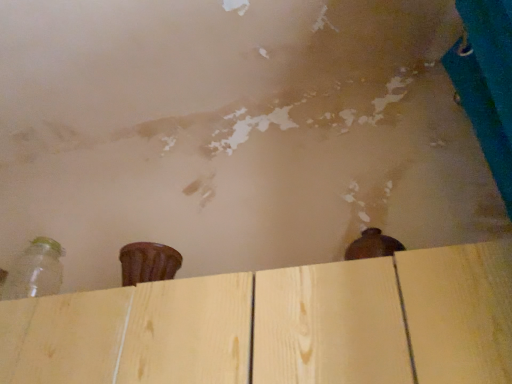
The image size is (512, 384). What do you see at coordinates (35, 271) in the screenshot?
I see `transparent glass bottle at lower left` at bounding box center [35, 271].

Identify the location of transparent glass bottle at lower left. (35, 271).

What do you see at coordinates (280, 325) in the screenshot? The height and width of the screenshot is (384, 512). I see `natural wood plywood at center` at bounding box center [280, 325].

Locate an element on the screen. Image resolution: width=512 pixels, height=384 pixels. natural wood plywood at center is located at coordinates (280, 325).

The height and width of the screenshot is (384, 512). I want to click on transparent glass bottle at lower left, so click(35, 271).

Can you confirm if transparent glass bottle at lower left is positioned to the left of natural wood plywood at center?

Yes, transparent glass bottle at lower left is to the left of natural wood plywood at center.

In the scene shown: Which object is further away from the camera taking this photo, transparent glass bottle at lower left or natural wood plywood at center?

transparent glass bottle at lower left is more distant.

Is point (50, 282) closer or farther from the camera than point (304, 366)?

Point (50, 282) is positioned farther from the camera compared to point (304, 366).

From the image's perspective, relative to natural wood plywood at center, is transparent glass bottle at lower left above or below?

Based on their image positions, transparent glass bottle at lower left is located above natural wood plywood at center.

From a real-world perspective, is transparent glass bottle at lower left under natural wood plywood at center?

Actually, transparent glass bottle at lower left is physically above natural wood plywood at center in the real world.

Based on the photo, in terms of width, does transparent glass bottle at lower left look wider or thinner when compared to natural wood plywood at center?

transparent glass bottle at lower left is thinner than natural wood plywood at center.

Looking at this image, which of these two, transparent glass bottle at lower left or natural wood plywood at center, stands taller?

With more height is natural wood plywood at center.

Considering the sizes of transparent glass bottle at lower left and natural wood plywood at center in the image, is transparent glass bottle at lower left bigger or smaller than natural wood plywood at center?

In the image, transparent glass bottle at lower left appears to be smaller than natural wood plywood at center.

Is transparent glass bottle at lower left situated inside natural wood plywood at center or outside?

transparent glass bottle at lower left exists outside the volume of natural wood plywood at center.

Is transparent glass bottle at lower left beside natural wood plywood at center?

No, transparent glass bottle at lower left is not next to natural wood plywood at center.

Is transparent glass bottle at lower left aimed at natural wood plywood at center?

No.

Can you tell me how much transparent glass bottle at lower left and natural wood plywood at center differ in facing direction?

The angular difference between transparent glass bottle at lower left and natural wood plywood at center is 1.16 degrees.

Where is `bottle above the natural wood plywood at center (from the image's perspective)`? This screenshot has height=384, width=512. bottle above the natural wood plywood at center (from the image's perspective) is located at coordinates (35, 271).

Visually, is natural wood plywood at center positioned to the left or to the right of transparent glass bottle at lower left?

natural wood plywood at center is to the right of transparent glass bottle at lower left.

Between natural wood plywood at center and transparent glass bottle at lower left, which one is positioned behind?

transparent glass bottle at lower left is further from the camera.

Is point (398, 285) less distant than point (32, 244)?

Yes, point (398, 285) is in front of point (32, 244).

From the image's perspective, is natural wood plywood at center under transparent glass bottle at lower left?

Yes.

From a real-world perspective, who is located lower, natural wood plywood at center or transparent glass bottle at lower left?

natural wood plywood at center is physically lower.

Based on the photo, is natural wood plywood at center wider than transparent glass bottle at lower left?

Yes.

Which of these two, natural wood plywood at center or transparent glass bottle at lower left, stands taller?

natural wood plywood at center.

Considering the sizes of objects natural wood plywood at center and transparent glass bottle at lower left in the image provided, who is bigger, natural wood plywood at center or transparent glass bottle at lower left?

Bigger between the two is natural wood plywood at center.

Can transparent glass bottle at lower left be found inside natural wood plywood at center?

No, transparent glass bottle at lower left is not inside natural wood plywood at center.

Would you consider natural wood plywood at center to be distant from transparent glass bottle at lower left?

natural wood plywood at center is near transparent glass bottle at lower left, not far away.

Does natural wood plywood at center turn towards transparent glass bottle at lower left?

No, natural wood plywood at center is not facing towards transparent glass bottle at lower left.

What's the angular difference between natural wood plywood at center and transparent glass bottle at lower left's facing directions?

There is a 1.16-degree angle between the facing directions of natural wood plywood at center and transparent glass bottle at lower left.

Find the location of `bottle above the natural wood plywood at center (from a real-world perspective)`. bottle above the natural wood plywood at center (from a real-world perspective) is located at coordinates (35, 271).

The width and height of the screenshot is (512, 384). Find the location of `plywood in front of the transparent glass bottle at lower left`. plywood in front of the transparent glass bottle at lower left is located at coordinates pyautogui.click(x=280, y=325).

This screenshot has width=512, height=384. In order to click on plywood below the transparent glass bottle at lower left (from the image's perspective) in this screenshot , I will do `click(280, 325)`.